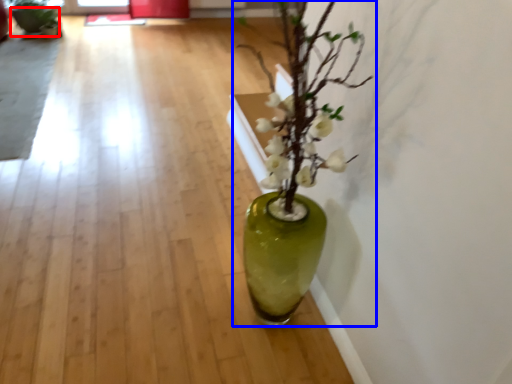
Question: Which object appears closest to the camera in this image, flowerpot (highlighted by a red box) or houseplant (highlighted by a blue box)?

Choices:
 (A) flowerpot
 (B) houseplant

Answer: (B)